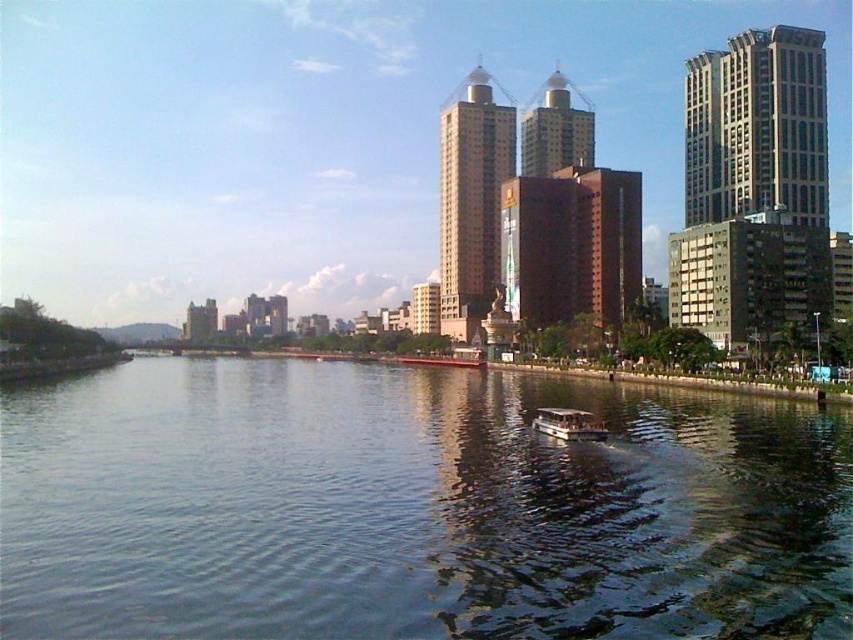
Question: Which point is farther from the camera taking this photo?

Choices:
 (A) (575, 433)
 (B) (291, 385)

Answer: (B)

Question: Does green reflective water at center have a larger size compared to metallic silver boat at center?

Choices:
 (A) no
 (B) yes

Answer: (B)

Question: Can you confirm if green reflective water at center is positioned to the left of metallic silver boat at center?

Choices:
 (A) yes
 (B) no

Answer: (A)

Question: Is green reflective water at center to the left of metallic silver boat at center from the viewer's perspective?

Choices:
 (A) yes
 (B) no

Answer: (A)